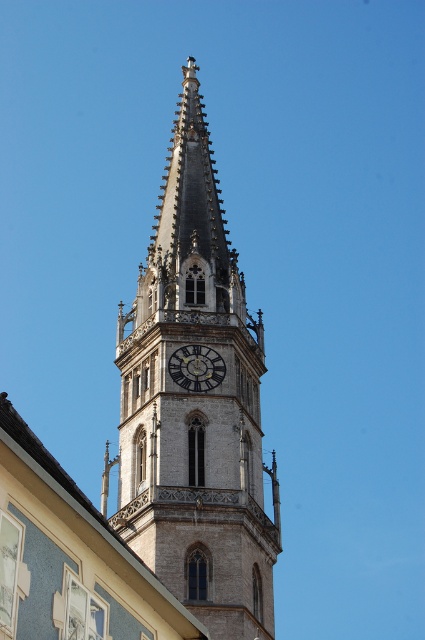
Is the position of stone clock tower at center less distant than that of gold metallic clock at center?

Yes.

Is stone clock tower at center bigger than gold metallic clock at center?

Yes.

Does point (227, 333) lie in front of point (221, 356)?

No, it is not.

Locate an element on the screen. The image size is (425, 640). stone clock tower at center is located at coordinates (195, 404).